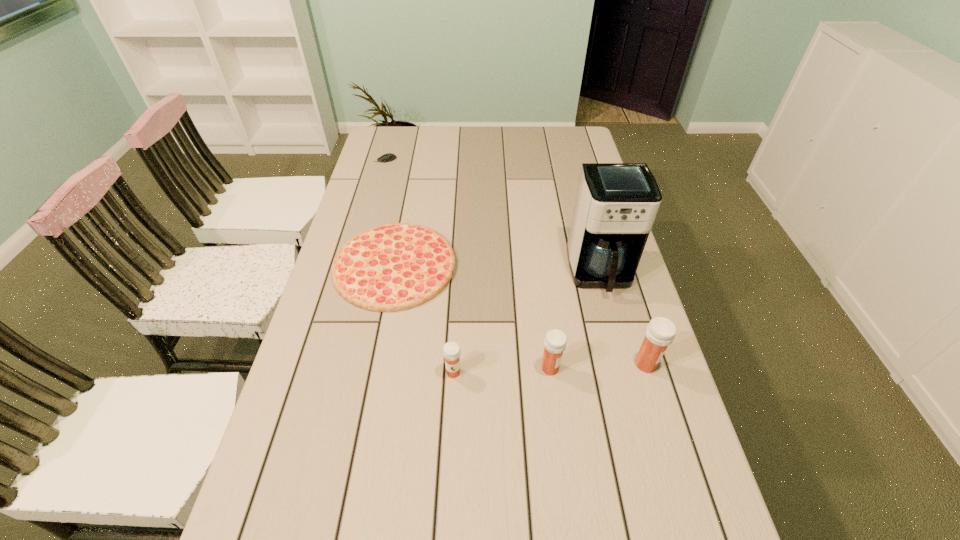
Identify the location of blank area located on the label side of the second tallest medicine. The width and height of the screenshot is (960, 540). (626, 368).

Identify the location of vacant space located on the right of the computer mouse. (462, 160).

You are a GUI agent. You are given a task and a screenshot of the screen. Output one action in this format:
    pyautogui.click(x=<x>, y=<y>)
    Task: Click on the vacant space situated 0.220m on the front panel of the coffee maker
    
    Given the screenshot: What is the action you would take?
    pyautogui.click(x=625, y=368)

You are a GUI agent. You are given a task and a screenshot of the screen. Output one action in this format:
    pyautogui.click(x=<x>, y=<y>)
    Task: Click on the vacant space situated 0.300m on the front of the pizza
    
    Given the screenshot: What is the action you would take?
    pyautogui.click(x=366, y=416)

Find the location of a particular element. The image size is (960, 540). computer mouse that is at the left edge is located at coordinates (388, 157).

You are a GUI agent. You are given a task and a screenshot of the screen. Output one action in this format:
    pyautogui.click(x=<x>, y=<y>)
    Task: Click on the pizza positioned at the left edge
    This screenshot has height=540, width=960.
    Given the screenshot: What is the action you would take?
    pyautogui.click(x=392, y=267)

Locate an element on the screen. medicine present at the right edge is located at coordinates (660, 332).

What are the coordinates of `coffee maker that is at the right edge` in the screenshot? It's located at (616, 204).

You are a GUI agent. You are given a task and a screenshot of the screen. Output one action in this format:
    pyautogui.click(x=<x>, y=<y>)
    Task: Click on the vacant space at the far edge
    This screenshot has height=540, width=960.
    Given the screenshot: What is the action you would take?
    pyautogui.click(x=449, y=132)

Where is `vacant space at the near edge of the desktop`? The image size is (960, 540). vacant space at the near edge of the desktop is located at coordinates (442, 514).